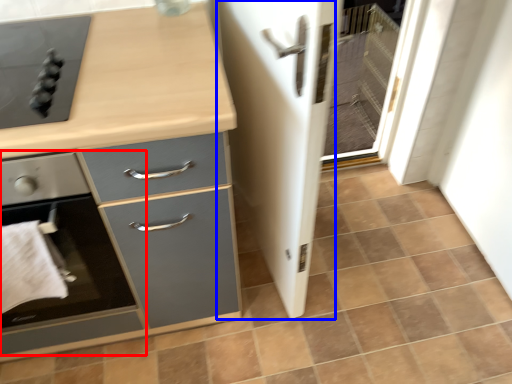
Question: Which of the following is the farthest to the observer, home appliance (highlighted by a red box) or screen door (highlighted by a blue box)?

Choices:
 (A) home appliance
 (B) screen door

Answer: (A)